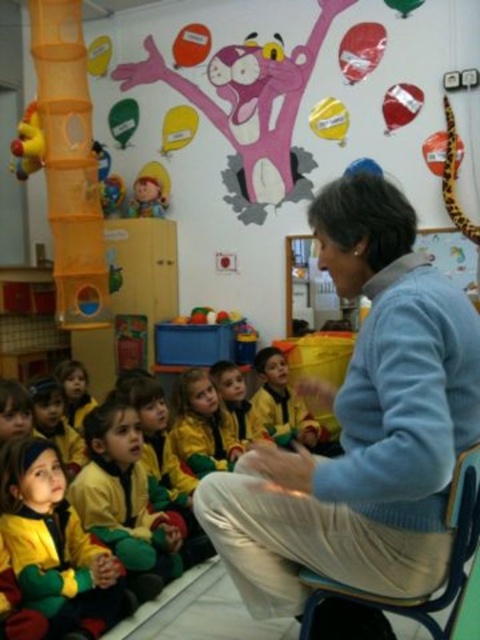
Is blue fleece jacket at center to the right of yellow-green uniform at center from the viewer's perspective?

Indeed, blue fleece jacket at center is positioned on the right side of yellow-green uniform at center.

Identify the location of blue fleece jacket at center. The image size is (480, 640). (361, 426).

Find the location of a particular element. The width and height of the screenshot is (480, 640). blue fleece jacket at center is located at coordinates (361, 426).

This screenshot has width=480, height=640. What do you see at coordinates (202, 426) in the screenshot?
I see `yellow-green uniform at center` at bounding box center [202, 426].

Who is positioned more to the left, yellow-green uniform at center or yellow rubber duck at left?

yellow rubber duck at left

Is point (199, 371) farther from camera compared to point (23, 120)?

No, it is not.

You are a GUI agent. You are given a task and a screenshot of the screen. Output one action in this format:
    pyautogui.click(x=<x>, y=<y>)
    Task: Click on the yellow-green uniform at center
    
    Given the screenshot: What is the action you would take?
    pyautogui.click(x=202, y=426)

Can you confirm if yellow-green fabric jacket at lower left is positioned to the right of yellow-green jersey at center?

In fact, yellow-green fabric jacket at lower left is to the left of yellow-green jersey at center.

Can you confirm if yellow-green fabric jacket at lower left is positioned below yellow-green jersey at center?

Yes.

Is point (55, 512) less distant than point (108, 515)?

That is True.

Find the location of `yellow-green fabric jacket at lower left`. yellow-green fabric jacket at lower left is located at coordinates (55, 544).